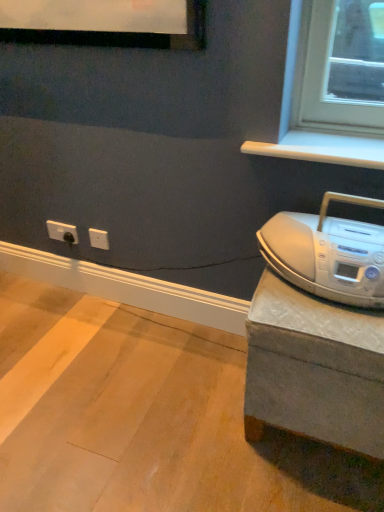
Question: Does gray concrete at right lie behind white plastic outlet at lower left?

Choices:
 (A) no
 (B) yes

Answer: (A)

Question: Is gray concrete at right positioned beyond the bounds of white plastic outlet at lower left?

Choices:
 (A) no
 (B) yes

Answer: (B)

Question: Does gray concrete at right have a larger size compared to white plastic outlet at lower left?

Choices:
 (A) yes
 (B) no

Answer: (A)

Question: From a real-world perspective, does gray concrete at right stand above white plastic outlet at lower left?

Choices:
 (A) no
 (B) yes

Answer: (A)

Question: Does gray concrete at right have a greater height compared to white plastic outlet at lower left?

Choices:
 (A) yes
 (B) no

Answer: (B)

Question: In the image, is silver metallic boombox at right positioned in front of or behind gray concrete at right?

Choices:
 (A) front
 (B) behind

Answer: (B)

Question: From the image's perspective, is silver metallic boombox at right above or below gray concrete at right?

Choices:
 (A) below
 (B) above

Answer: (B)

Question: Considering the positions of silver metallic boombox at right and gray concrete at right in the image, is silver metallic boombox at right wider or thinner than gray concrete at right?

Choices:
 (A) wide
 (B) thin

Answer: (B)

Question: Is silver metallic boombox at right taller or shorter than gray concrete at right?

Choices:
 (A) short
 (B) tall

Answer: (B)

Question: Considering the positions of white plastic outlet at lower left and silver metallic boombox at right in the image, is white plastic outlet at lower left taller or shorter than silver metallic boombox at right?

Choices:
 (A) short
 (B) tall

Answer: (A)

Question: Considering the positions of point (59, 230) and point (327, 265), is point (59, 230) closer or farther from the camera than point (327, 265)?

Choices:
 (A) closer
 (B) farther

Answer: (B)

Question: Considering the relative positions of white plastic outlet at lower left and silver metallic boombox at right in the image provided, is white plastic outlet at lower left to the left or to the right of silver metallic boombox at right?

Choices:
 (A) right
 (B) left

Answer: (B)

Question: From a real-world perspective, is white plastic outlet at lower left physically located above or below silver metallic boombox at right?

Choices:
 (A) below
 (B) above

Answer: (A)

Question: Looking at their shapes, would you say gray concrete at right is wider or thinner than silver metallic boombox at right?

Choices:
 (A) thin
 (B) wide

Answer: (B)

Question: From a real-world perspective, is gray concrete at right above or below silver metallic boombox at right?

Choices:
 (A) above
 (B) below

Answer: (B)